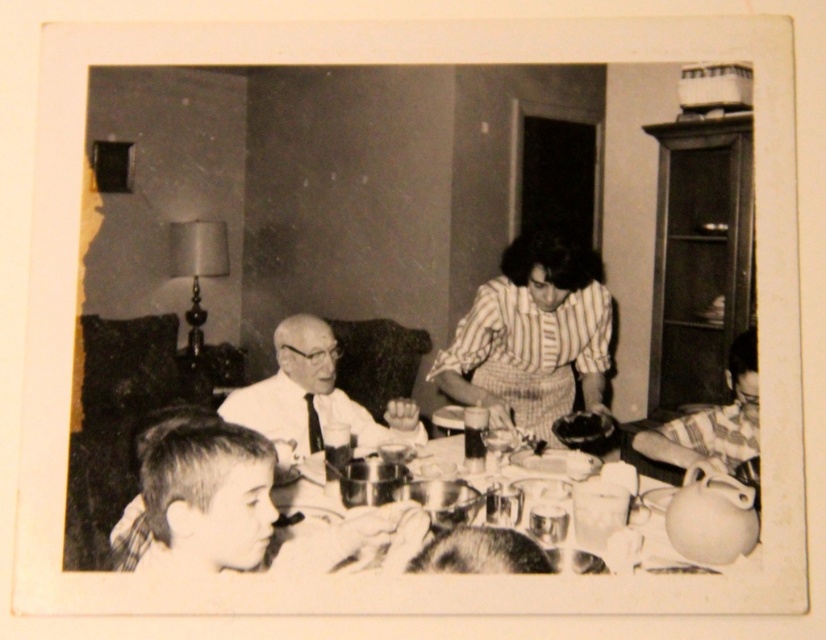
Which is more to the left, striped fabric dress at center or striped fabric shirt at lower right?

Positioned to the left is striped fabric dress at center.

Does striped fabric dress at center appear under striped fabric shirt at lower right?

Incorrect, striped fabric dress at center is not positioned below striped fabric shirt at lower right.

This screenshot has height=640, width=826. What are the coordinates of `striped fabric dress at center` in the screenshot? It's located at (532, 337).

This screenshot has height=640, width=826. I want to click on striped fabric dress at center, so click(532, 337).

How distant is striped fabric dress at center from white matte shirt at center?

The distance of striped fabric dress at center from white matte shirt at center is 16.03 inches.

Is striped fabric dress at center bigger than white matte shirt at center?

Yes.

Does point (487, 396) come farther from viewer compared to point (250, 419)?

That is True.

Where is `striped fabric dress at center`? striped fabric dress at center is located at coordinates (532, 337).

Image resolution: width=826 pixels, height=640 pixels. I want to click on metallic reflective tableware at center, so click(558, 506).

Who is taller, metallic reflective tableware at center or white matte shirt at center?

With more height is white matte shirt at center.

Which is in front, point (447, 444) or point (406, 401)?

Positioned in front is point (406, 401).

The height and width of the screenshot is (640, 826). Identify the location of metallic reflective tableware at center. (558, 506).